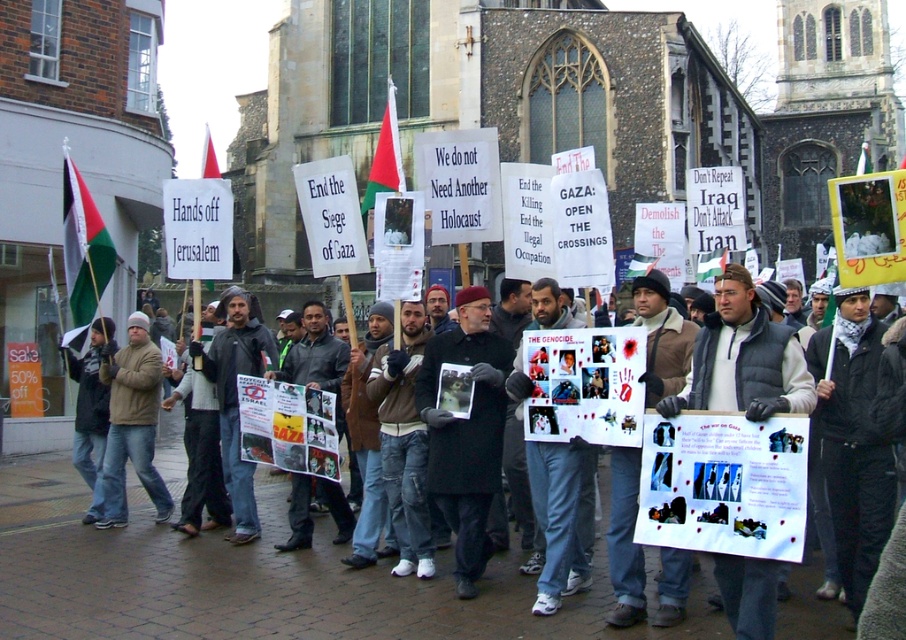
You are a photographer at the protest scene. You want to capture a photo that includes both the red fabric flag at center and the white fabric flag at center. Which flag will appear closer to the camera in the photo?

The red fabric flag at center is in front of the white fabric flag at center, so it will appear closer to the camera in the photo.

You are a photographer standing at the edge of the protest area. You want to capture a photo that includes both the dark gray jacket at center and the red fabric flag at center. Given that your camera has a maximum focus range of 15 meters, will you be able to include both objects in the same frame without moving closer?

The distance between the dark gray jacket at center and the red fabric flag at center is 17.81 meters, which exceeds the camera maximum focus range of 15 meters. Therefore, you will not be able to include both objects in the same frame without moving closer.

What is the primary color of the object located at the coordinates point (384, 157)?

The object at point (384, 157) is a red fabric flag at center.